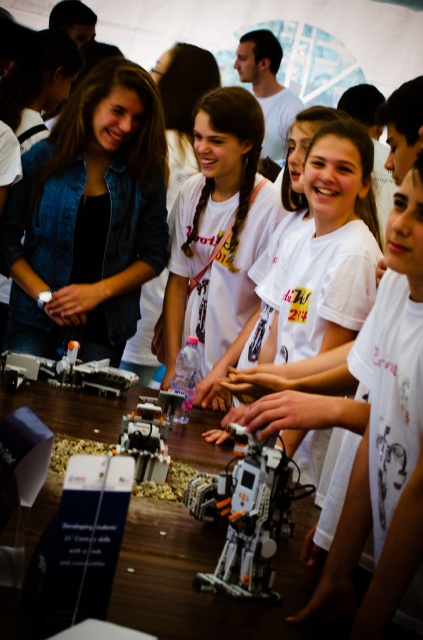
You are a participant at the robotics event and want to place a small LEGO part on the wooden table at center. However, there is a white matte hand at center in the way. Can you place the part on the table without moving the hand?

The wooden table at center is closer to the viewer than the white matte hand at center, so you can place the LEGO part on the wooden table at center without moving the hand because the table is in front of the hand.

You are a judge at the robotics event. You need to determine which hand is shorter between the smooth white hand at center and the smooth skin hand at center. Which one should you choose?

The smooth white hand at center is not as tall as the smooth skin hand at center, so you should choose the smooth white hand at center as the shorter one.